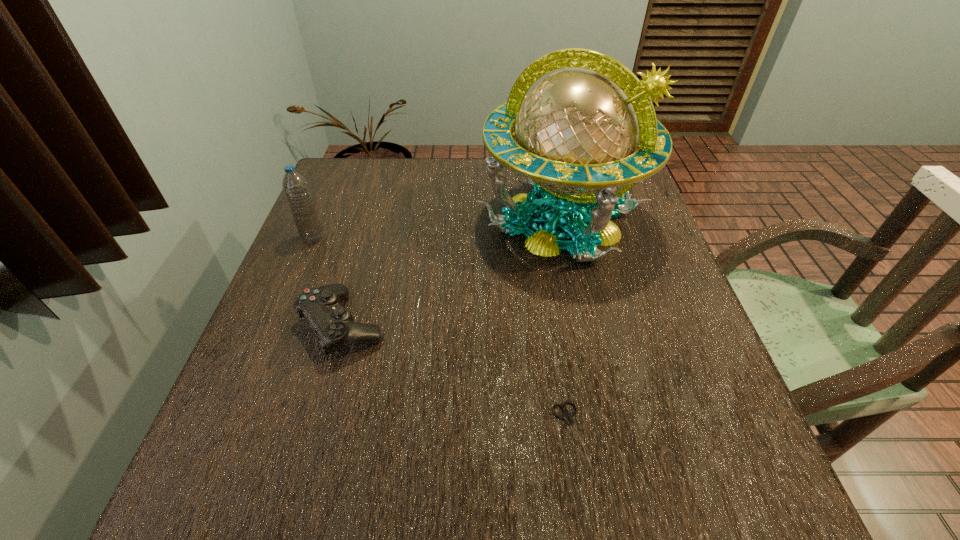
At what (x,y) coordinates should I click in order to perform the action: click on free space between the water bottle and the globe. Please return your answer as a coordinate pair (x, y). The image size is (960, 540). Looking at the image, I should click on (437, 229).

Locate an element on the screen. free space between the shears and the water bottle is located at coordinates (442, 335).

Where is `vacant space in between the leftmost object and the globe`? The width and height of the screenshot is (960, 540). vacant space in between the leftmost object and the globe is located at coordinates (437, 229).

Locate an element on the screen. This screenshot has width=960, height=540. object that stands as the third closest to the globe is located at coordinates (295, 187).

Image resolution: width=960 pixels, height=540 pixels. In order to click on the second closest object to the shears in this screenshot , I will do `click(334, 325)`.

At what (x,y) coordinates should I click in order to perform the action: click on free spot that satisfies the following two spatial constraints: 1. on the back side of the shortest object; 2. on the right side of the tallest object. Please return your answer as a coordinate pair (x, y). The width and height of the screenshot is (960, 540). Looking at the image, I should click on (539, 220).

The width and height of the screenshot is (960, 540). Identify the location of vacant space that satisfies the following two spatial constraints: 1. on the front side of the shortest object; 2. on the right side of the control. (314, 433).